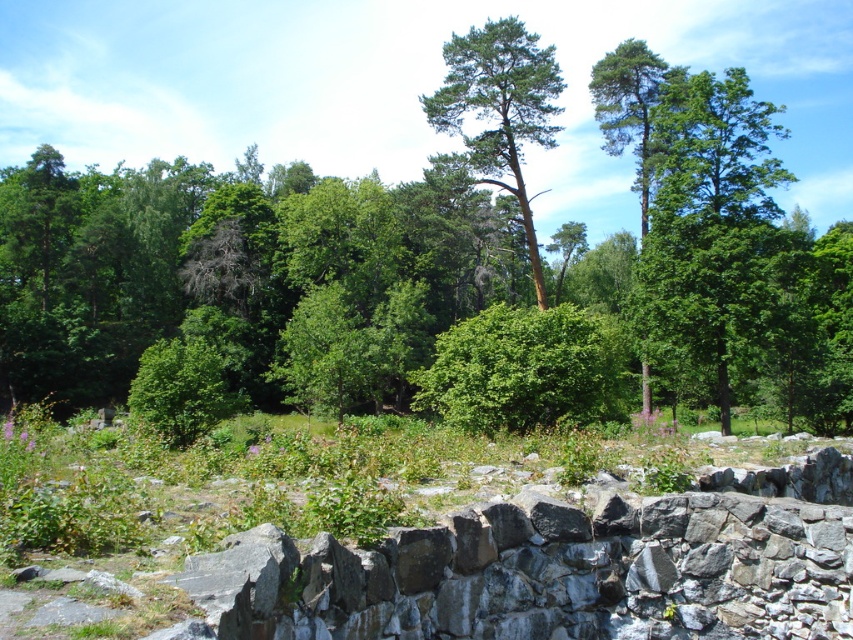
Is green leafy tree at upper right positioned behind green matte tree at upper right?

No, it is in front of green matte tree at upper right.

Can you confirm if green leafy tree at upper right is positioned below green matte tree at upper right?

Indeed, green leafy tree at upper right is positioned under green matte tree at upper right.

Who is more distant from viewer, (700, 102) or (648, 124)?

Positioned behind is point (648, 124).

Locate an element on the screen. green leafy tree at upper right is located at coordinates (708, 225).

Does green leafy forest at center have a greater height compared to green leafy tree at upper right?

Yes, green leafy forest at center is taller than green leafy tree at upper right.

Can you confirm if green leafy forest at center is bigger than green leafy tree at upper right?

Yes, green leafy forest at center is bigger than green leafy tree at upper right.

Is point (190, 172) farther from camera compared to point (688, 147)?

Yes, point (190, 172) is farther from viewer.

At what (x,y) coordinates should I click in order to perform the action: click on green leafy forest at center. Please return your answer as a coordinate pair (x, y). The image size is (853, 640). Looking at the image, I should click on (442, 250).

The height and width of the screenshot is (640, 853). What do you see at coordinates (442, 250) in the screenshot?
I see `green leafy forest at center` at bounding box center [442, 250].

Who is shorter, green leafy forest at center or green matte tree at upper right?

green matte tree at upper right

The height and width of the screenshot is (640, 853). Identify the location of green leafy forest at center. (442, 250).